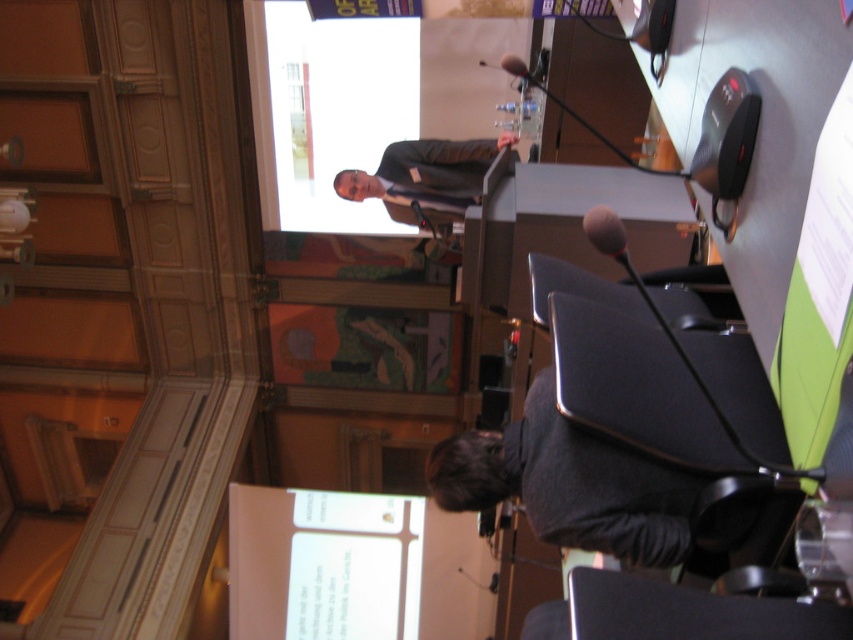
Question: Does dark gray sweater at lower center appear on the left side of matte black suit at upper center?

Choices:
 (A) no
 (B) yes

Answer: (A)

Question: Can you confirm if dark gray sweater at lower center is thinner than matte black suit at upper center?

Choices:
 (A) no
 (B) yes

Answer: (B)

Question: Is dark gray sweater at lower center wider than matte black suit at upper center?

Choices:
 (A) yes
 (B) no

Answer: (B)

Question: Which point appears farthest from the camera in this image?

Choices:
 (A) (427, 202)
 (B) (593, 468)

Answer: (A)